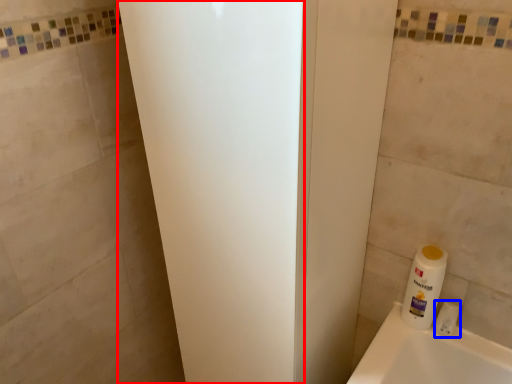
Question: Which of the following is the closest to the observer, screen door (highlighted by a red box) or toiletry (highlighted by a blue box)?

Choices:
 (A) screen door
 (B) toiletry

Answer: (A)